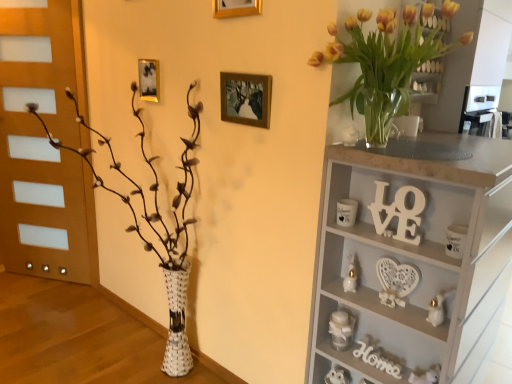
Question: Would you say white woven vase at left is outside gold metallic picture frame at upper center, the 3th picture frame ordered from the bottom?

Choices:
 (A) yes
 (B) no

Answer: (A)

Question: Is white woven vase at left taller than gold metallic picture frame at upper center, the 3th picture frame ordered from the bottom?

Choices:
 (A) no
 (B) yes

Answer: (B)

Question: Can you confirm if white woven vase at left is shorter than gold metallic picture frame at upper center, which ranks as the 1th picture frame in front-to-back order?

Choices:
 (A) no
 (B) yes

Answer: (A)

Question: Is white woven vase at left facing towards gold metallic picture frame at upper center, marked as the second picture frame in a right-to-left arrangement?

Choices:
 (A) no
 (B) yes

Answer: (A)

Question: Would you say white woven vase at left contains gold metallic picture frame at upper center, marked as the second picture frame in a left-to-right arrangement?

Choices:
 (A) yes
 (B) no

Answer: (B)

Question: Considering the relative positions of white woven vase at left and gold metallic picture frame at upper center, the 3th picture frame ordered from the bottom, in the image provided, is white woven vase at left in front of gold metallic picture frame at upper center, the 3th picture frame ordered from the bottom,?

Choices:
 (A) no
 (B) yes

Answer: (B)

Question: From the image's perspective, is gold metallic picture frame at upper center, marked as the second picture frame in a right-to-left arrangement, under gold metallic picture frame at upper center, which appears as the third picture frame when viewed from the right?

Choices:
 (A) no
 (B) yes

Answer: (A)

Question: Would you consider gold metallic picture frame at upper center, the 3th picture frame ordered from the bottom, to be distant from gold metallic picture frame at upper center, which is the 1th picture frame from back to front?

Choices:
 (A) no
 (B) yes

Answer: (A)

Question: Is gold metallic picture frame at upper center, which ranks as the 2th picture frame in bottom-to-top order, completely or partially inside gold metallic picture frame at upper center, the 3th picture frame ordered from the bottom?

Choices:
 (A) no
 (B) yes

Answer: (A)

Question: From the image's perspective, is gold metallic picture frame at upper center, the 3th picture frame ordered from the bottom, over gold metallic picture frame at upper center, which appears as the first picture frame when viewed from the left?

Choices:
 (A) yes
 (B) no

Answer: (A)

Question: Can you confirm if gold metallic picture frame at upper center, marked as the second picture frame in a left-to-right arrangement, is thinner than gold metallic picture frame at upper center, which appears as the third picture frame when viewed from the right?

Choices:
 (A) yes
 (B) no

Answer: (A)

Question: From a real-world perspective, is gold metallic picture frame at upper center, marked as the second picture frame in a left-to-right arrangement, positioned over gold metallic picture frame at upper center, the third picture frame positioned from the front, based on gravity?

Choices:
 (A) yes
 (B) no

Answer: (A)

Question: Is white wood shelf at upper right positioned behind gold metallic picture frame at upper center, the 3th picture frame ordered from the bottom?

Choices:
 (A) yes
 (B) no

Answer: (B)